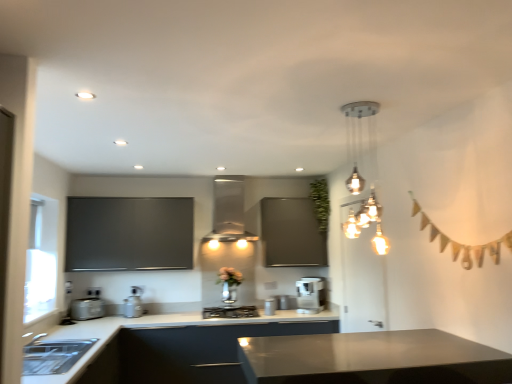
Question: Is green leafy plant at upper center looking in the opposite direction of satin black cabinet at lower left?

Choices:
 (A) no
 (B) yes

Answer: (A)

Question: Could you tell me if green leafy plant at upper center is facing satin black cabinet at lower left?

Choices:
 (A) no
 (B) yes

Answer: (A)

Question: Does green leafy plant at upper center touch satin black cabinet at lower left?

Choices:
 (A) no
 (B) yes

Answer: (A)

Question: Is green leafy plant at upper center shorter than satin black cabinet at lower left?

Choices:
 (A) no
 (B) yes

Answer: (B)

Question: Can you confirm if green leafy plant at upper center is positioned to the left of satin black cabinet at lower left?

Choices:
 (A) yes
 (B) no

Answer: (B)

Question: Is satin black cabinet at lower left in front of or behind matte gray countertop at lower center in the image?

Choices:
 (A) front
 (B) behind

Answer: (B)

Question: Considering the positions of point (93, 365) and point (64, 375), is point (93, 365) closer or farther from the camera than point (64, 375)?

Choices:
 (A) farther
 (B) closer

Answer: (A)

Question: Based on their sizes in the image, would you say satin black cabinet at lower left is bigger or smaller than matte gray countertop at lower center?

Choices:
 (A) small
 (B) big

Answer: (A)

Question: In terms of width, does satin black cabinet at lower left look wider or thinner when compared to matte gray countertop at lower center?

Choices:
 (A) wide
 (B) thin

Answer: (B)

Question: Considering the positions of green leafy plant at upper center and matte black board at upper left in the image, is green leafy plant at upper center taller or shorter than matte black board at upper left?

Choices:
 (A) short
 (B) tall

Answer: (A)

Question: Choose the correct answer: Is green leafy plant at upper center inside matte black board at upper left or outside it?

Choices:
 (A) outside
 (B) inside

Answer: (A)

Question: Considering the relative positions of green leafy plant at upper center and matte black board at upper left in the image provided, is green leafy plant at upper center to the left or to the right of matte black board at upper left?

Choices:
 (A) left
 (B) right

Answer: (B)

Question: Considering the positions of green leafy plant at upper center and matte black board at upper left in the image, is green leafy plant at upper center wider or thinner than matte black board at upper left?

Choices:
 (A) wide
 (B) thin

Answer: (B)

Question: Is satin silver toaster at lower left, which ranks as the 1th appliance in left-to-right order, in front of or behind satin silver coffee maker at center, the third appliance from the left, in the image?

Choices:
 (A) front
 (B) behind

Answer: (A)

Question: Is satin silver toaster at lower left, which ranks as the 1th appliance in left-to-right order, situated inside satin silver coffee maker at center, the third appliance from the left, or outside?

Choices:
 (A) inside
 (B) outside

Answer: (B)